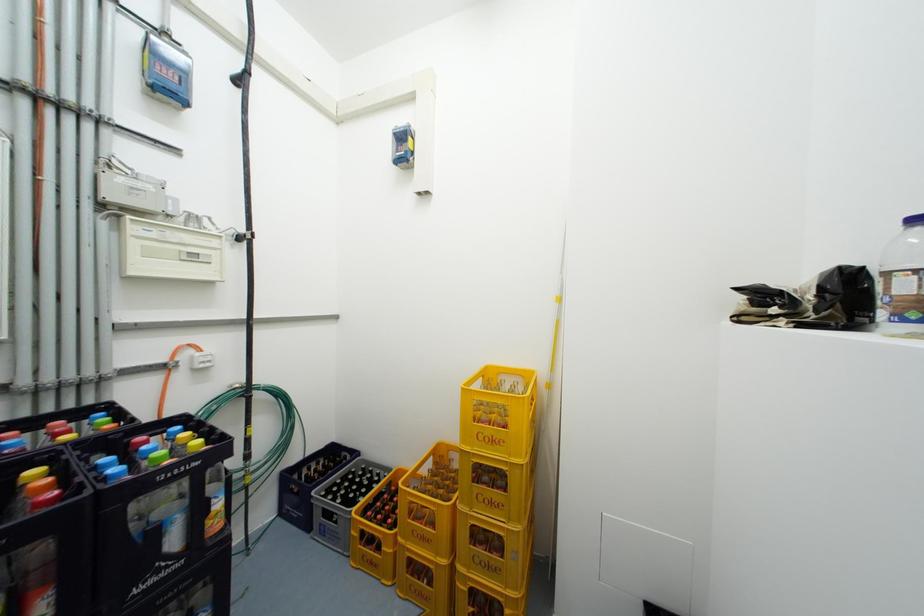
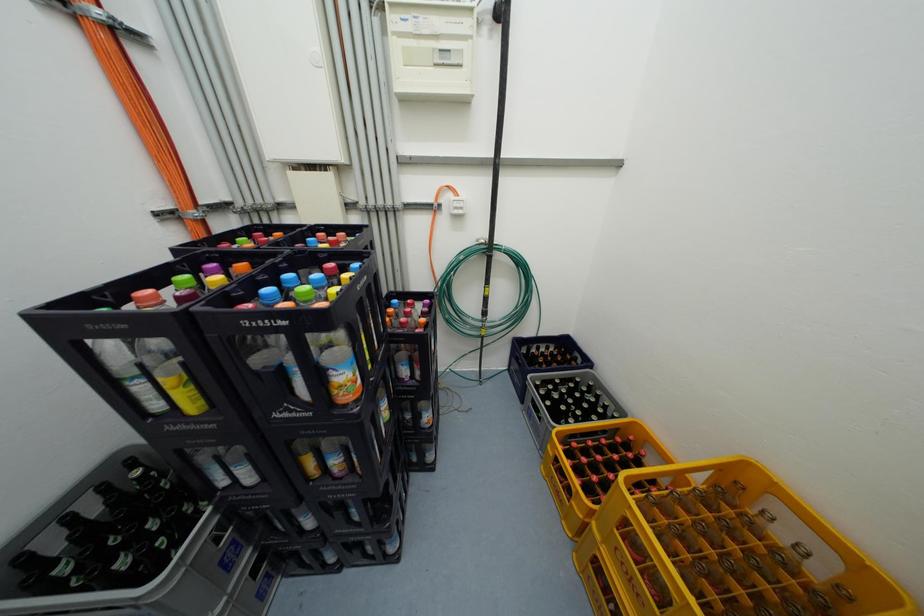
How did the camera likely rotate?

The camera rotated toward left-down.